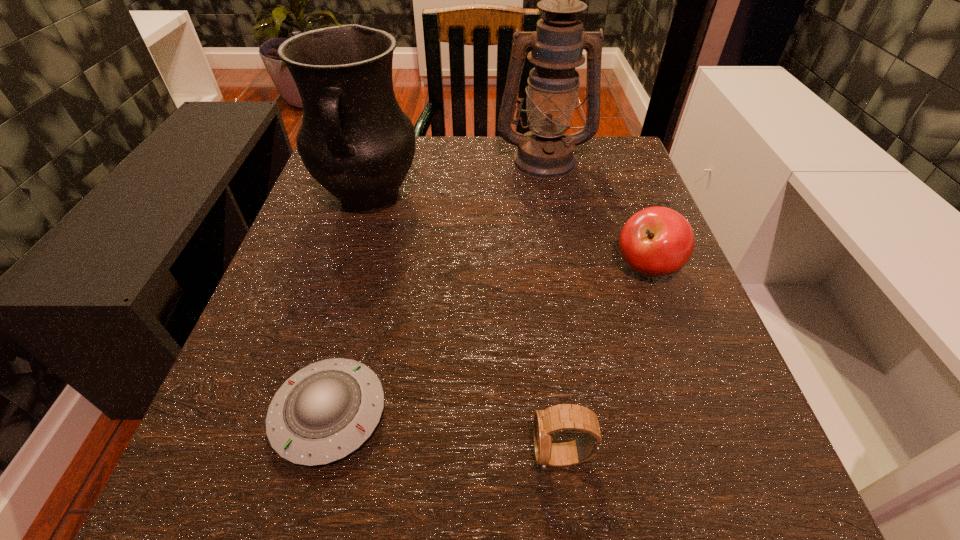
Locate an element on the screen. The height and width of the screenshot is (540, 960). vacant space located 0.070m on the face of the watch is located at coordinates (477, 456).

The height and width of the screenshot is (540, 960). Identify the location of vacant space located 0.090m on the right of the saucer. (453, 414).

Locate an element on the screen. oil lamp at the far edge is located at coordinates click(545, 152).

You are a GUI agent. You are given a task and a screenshot of the screen. Output one action in this format:
    pyautogui.click(x=<x>, y=<y>)
    Task: Click on the pitcher located in the far edge section of the desktop
    The image size is (960, 540).
    Given the screenshot: What is the action you would take?
    pyautogui.click(x=355, y=140)

I want to click on watch that is positioned at the near edge, so click(x=560, y=417).

Where is `saucer located at the near edge`? saucer located at the near edge is located at coordinates 325,411.

What are the coordinates of `pitcher that is positioned at the left edge` in the screenshot? It's located at (355, 140).

This screenshot has height=540, width=960. Identify the location of saucer positioned at the left edge. (325, 411).

Image resolution: width=960 pixels, height=540 pixels. Find the location of `oil lamp located in the right edge section of the desktop`. oil lamp located in the right edge section of the desktop is located at coordinates (545, 152).

What are the coordinates of `apple that is at the right edge` in the screenshot? It's located at (657, 241).